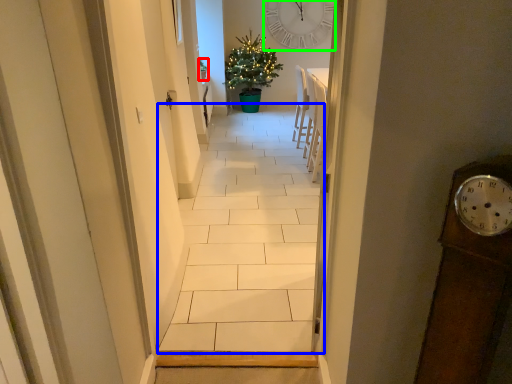
Question: Which object is positioned farthest from houseplant (highlighted by a red box)? Select from path (highlighted by a blue box) and clock (highlighted by a green box).

Choices:
 (A) path
 (B) clock

Answer: (A)